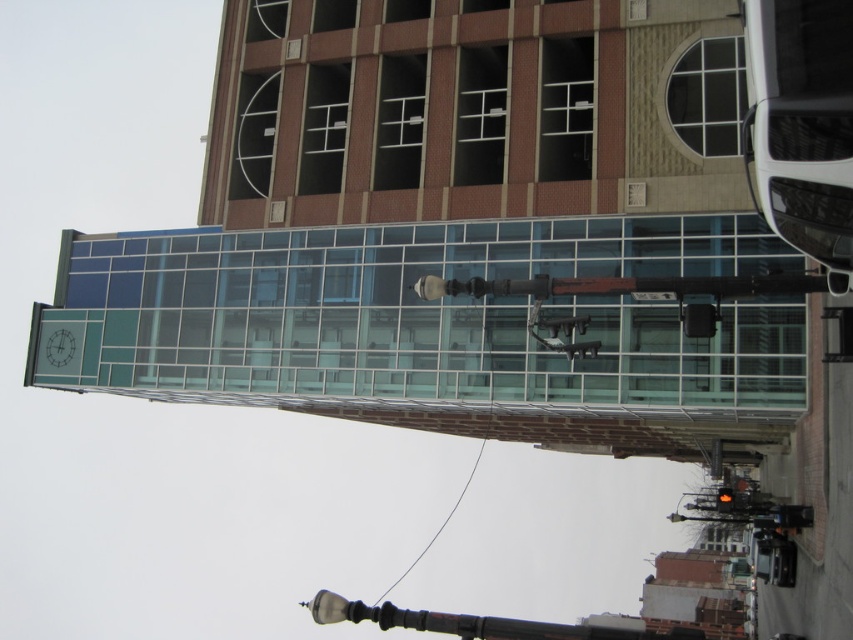
You are a pedestrian standing on the sidewalk in front of the building. You notice the clear wire at center and the orange glass traffic light at center. Which object is closer to you?

The clear wire at center is closer to you because the orange glass traffic light at center is behind it.

You are standing at the bottom center of the image where the streetlight is located. You want to walk towards the building. Which point, point (479, 454) or point (724, 502), will you encounter first?

You will encounter point (724, 502) first because it is closer to you than point (479, 454), which is behind it.